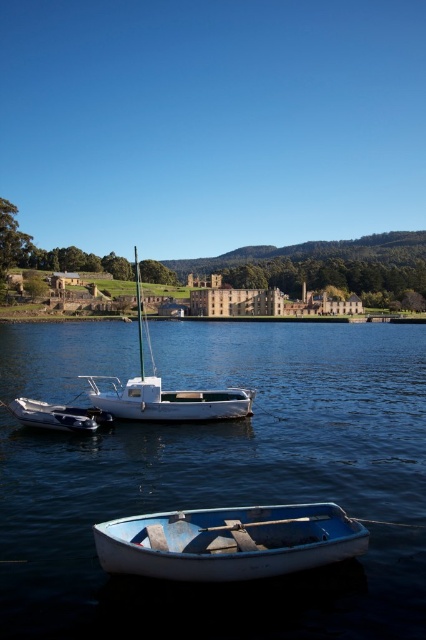
Question: Is blue glossy water at center above white matte sailboat at center?

Choices:
 (A) no
 (B) yes

Answer: (A)

Question: Where is white matte sailboat at center located in relation to metallic blue dinghy at lower center in the image?

Choices:
 (A) left
 (B) right

Answer: (A)

Question: In this image, where is white matte rowboat at lower center located relative to white matte sailboat at center?

Choices:
 (A) below
 (B) above

Answer: (A)

Question: Among these objects, which one is nearest to the camera?

Choices:
 (A) metallic blue dinghy at lower center
 (B) blue glossy water at center

Answer: (B)

Question: Among these points, which one is farthest from the camera?

Choices:
 (A) (55, 420)
 (B) (150, 349)
 (C) (69, 577)
 (D) (178, 579)

Answer: (B)

Question: Which of the following is the farthest from the observer?

Choices:
 (A) metallic blue dinghy at lower center
 (B) white matte sailboat at center

Answer: (B)